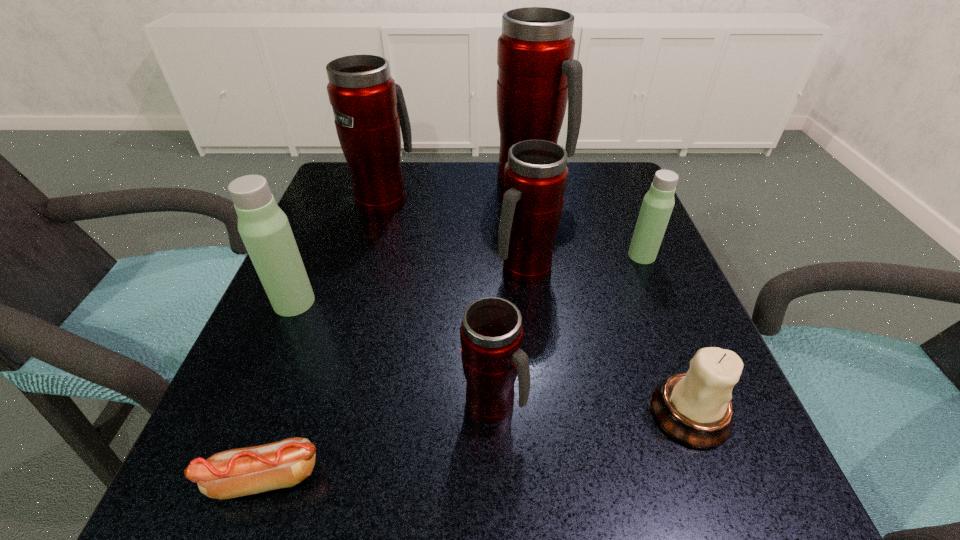
Identify the location of vacant space located on the side with the handle of the smallest red thermos bottle. This screenshot has height=540, width=960. (663, 403).

Locate an element on the screen. This screenshot has height=540, width=960. free space located 0.100m on the left of the white candle holder is located at coordinates (580, 413).

Find the location of a particular element. Image resolution: width=960 pixels, height=540 pixels. vacant space situated 0.300m on the back of the sausage is located at coordinates (330, 290).

At what (x,y) coordinates should I click in order to perform the action: click on candle holder that is at the near edge. Please return your answer as a coordinate pair (x, y). This screenshot has height=540, width=960. Looking at the image, I should click on (694, 408).

The width and height of the screenshot is (960, 540). What are the coordinates of `sausage at the near edge` in the screenshot? It's located at (239, 472).

This screenshot has width=960, height=540. I want to click on sausage present at the left edge, so [x=239, y=472].

Locate an element on the screen. Image resolution: width=960 pixels, height=540 pixels. candle holder that is positioned at the right edge is located at coordinates (694, 408).

What are the coordinates of `object present at the far left corner` in the screenshot? It's located at (369, 108).

At what (x,y) coordinates should I click in order to perform the action: click on object that is at the near left corner. Please return your answer as a coordinate pair (x, y). This screenshot has width=960, height=540. Looking at the image, I should click on (239, 472).

At what (x,y) coordinates should I click in order to perform the action: click on object present at the far right corner. Please return your answer as a coordinate pair (x, y). The height and width of the screenshot is (540, 960). Looking at the image, I should click on [x=537, y=75].